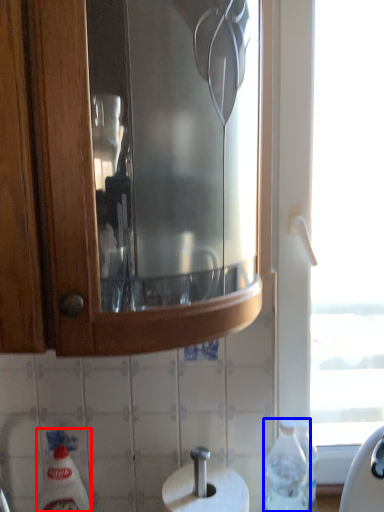
Question: Which object appears closest to the camera in this image, cleaning product (highlighted by a red box) or bottle (highlighted by a blue box)?

Choices:
 (A) cleaning product
 (B) bottle

Answer: (B)